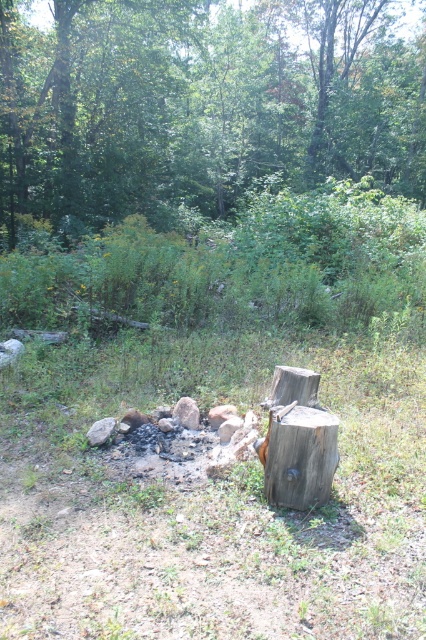
You are planning to set up a tent in this forest area. You need to choose between placing it under the green leafy tree at upper center or near the weathered brown wood at center. Based on their positions, which location would provide more shade during midday?

The green leafy tree at upper center is located above the weathered brown wood at center, so placing the tent under the green leafy tree at upper center would provide more shade during midday because it is positioned higher and likely casts a larger shadow.

From the picture: You are a hiker trying to determine the best spot to set up your tent. You notice a green leafy tree at upper center and a weathered brown wood at center. Which object is closer to you, the hiker?

The green leafy tree at upper center is closer to you because the weathered brown wood at center is behind it.